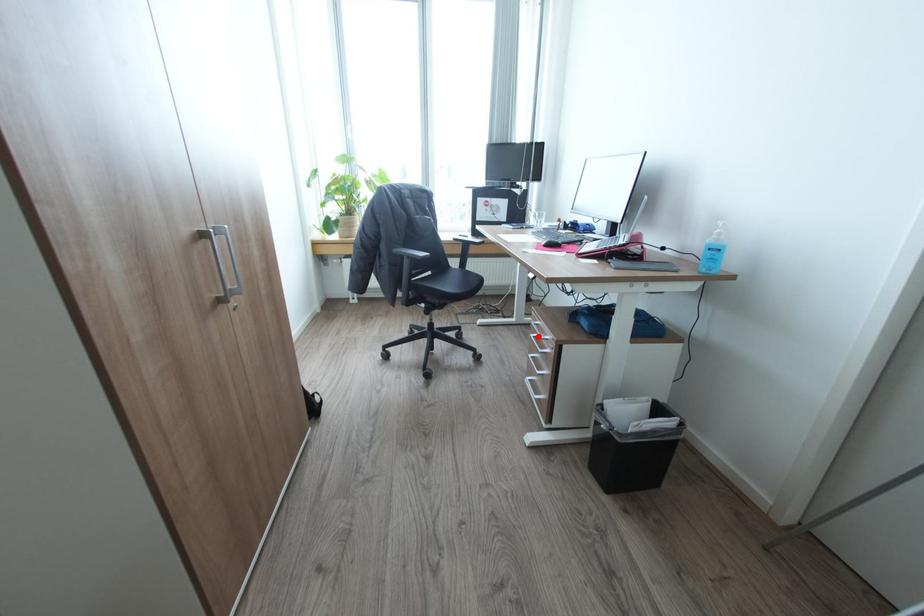
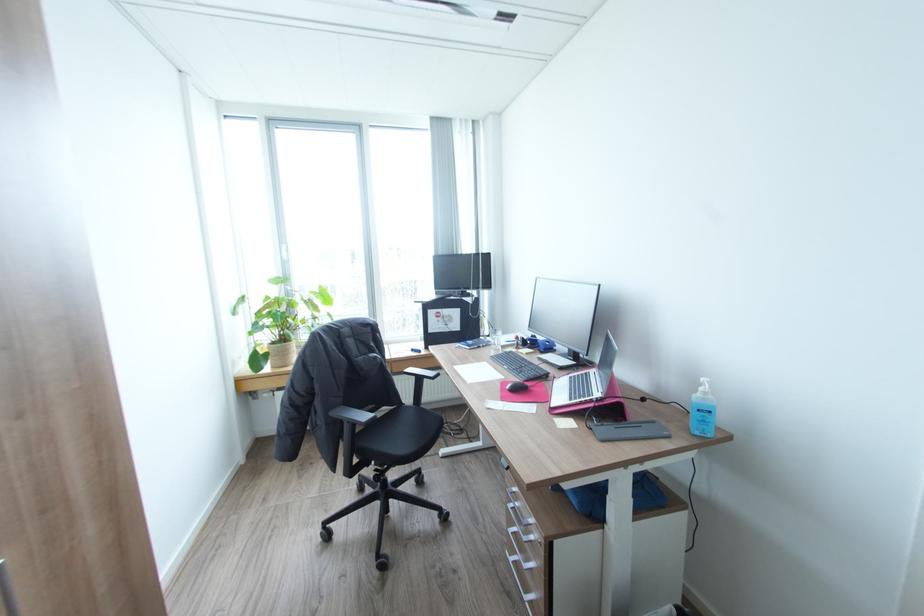
Question: A red point is marked in image1. In image2, is the corresponding 3D point closer to the camera or farther? Reply with the corresponding letter.

Choices:
 (A) The corresponding 3D point is closer.
 (B) The corresponding 3D point is farther.

Answer: (B)